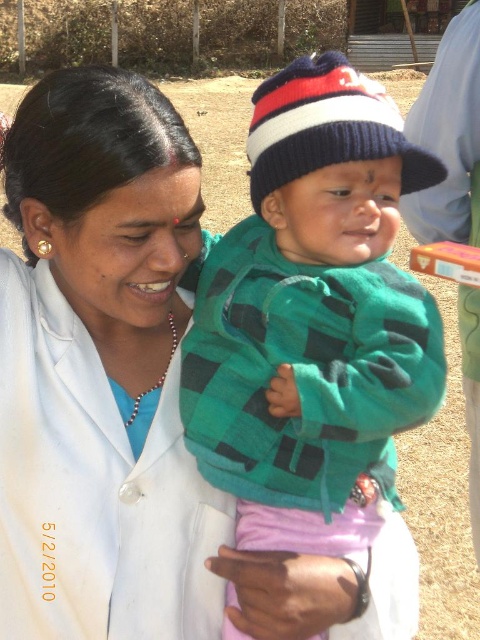
Who is higher up, white smooth lab coat at center or green plaid sweater at center?

green plaid sweater at center is higher up.

Can you confirm if white smooth lab coat at center is thinner than green plaid sweater at center?

Yes, white smooth lab coat at center is thinner than green plaid sweater at center.

At what (x,y) coordinates should I click in order to perform the action: click on white smooth lab coat at center. Please return your answer as a coordinate pair (x, y). Looking at the image, I should click on (100, 371).